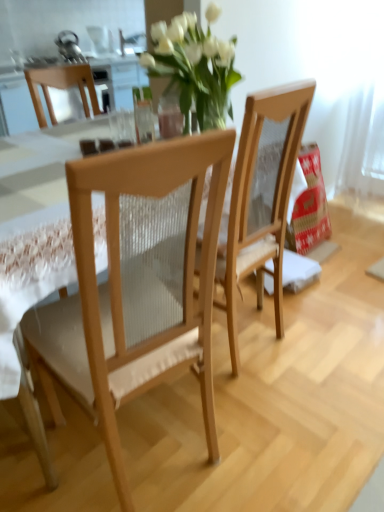
Where is `light wood mesh chair at center, the first chair viewed from the left`? This screenshot has width=384, height=512. light wood mesh chair at center, the first chair viewed from the left is located at coordinates (136, 285).

The image size is (384, 512). Describe the element at coordinates (136, 285) in the screenshot. I see `light wood mesh chair at center, the first chair viewed from the left` at that location.

What do you see at coordinates (261, 198) in the screenshot?
I see `natural wood chair at center, marked as the 1th chair in a right-to-left arrangement` at bounding box center [261, 198].

Find the location of a particular element. Image resolution: width=384 pixels, height=512 pixels. natural wood chair at center, marked as the 1th chair in a right-to-left arrangement is located at coordinates (261, 198).

What is the approximate width of natural wood chair at center, marked as the 1th chair in a right-to-left arrangement?

natural wood chair at center, marked as the 1th chair in a right-to-left arrangement, is 17.62 inches in width.

What are the coordinates of `light wood mesh chair at center, the first chair viewed from the left` in the screenshot? It's located at (136, 285).

Is natural wood chair at center, marked as the 1th chair in a right-to-left arrangement, to the left of light wood mesh chair at center, the first chair viewed from the left, from the viewer's perspective?

In fact, natural wood chair at center, marked as the 1th chair in a right-to-left arrangement, is to the right of light wood mesh chair at center, the first chair viewed from the left.

In the image, is natural wood chair at center, the 2th chair in the left-to-right sequence, positioned in front of or behind light wood mesh chair at center, the second chair viewed from the right?

Visually, natural wood chair at center, the 2th chair in the left-to-right sequence, is located behind light wood mesh chair at center, the second chair viewed from the right.

Between point (284, 159) and point (88, 181), which one is positioned in front?

The point (88, 181) is closer to the camera.

Looking at this image, from the image's perspective, which is below, natural wood chair at center, the 2th chair in the left-to-right sequence, or light wood mesh chair at center, the first chair viewed from the left?

light wood mesh chair at center, the first chair viewed from the left, from the image's perspective.

From a real-world perspective, is natural wood chair at center, the 2th chair in the left-to-right sequence, physically located above or below light wood mesh chair at center, the first chair viewed from the left?

Clearly, from a real-world perspective, natural wood chair at center, the 2th chair in the left-to-right sequence, is above light wood mesh chair at center, the first chair viewed from the left.

Between natural wood chair at center, the 2th chair in the left-to-right sequence, and light wood mesh chair at center, the second chair viewed from the right, which one has larger width?

Wider between the two is light wood mesh chair at center, the second chair viewed from the right.

Which of these two, natural wood chair at center, the 2th chair in the left-to-right sequence, or light wood mesh chair at center, the first chair viewed from the left, stands shorter?

With less height is light wood mesh chair at center, the first chair viewed from the left.

Based on their sizes in the image, would you say natural wood chair at center, the 2th chair in the left-to-right sequence, is bigger or smaller than light wood mesh chair at center, the first chair viewed from the left?

Considering their sizes, natural wood chair at center, the 2th chair in the left-to-right sequence, takes up less space than light wood mesh chair at center, the first chair viewed from the left.

Would you say light wood mesh chair at center, the second chair viewed from the right, is part of natural wood chair at center, the 2th chair in the left-to-right sequence,'s contents?

Definitely not — light wood mesh chair at center, the second chair viewed from the right, is not inside natural wood chair at center, the 2th chair in the left-to-right sequence.

Is natural wood chair at center, the 2th chair in the left-to-right sequence, directly adjacent to light wood mesh chair at center, the second chair viewed from the right?

No, natural wood chair at center, the 2th chair in the left-to-right sequence, is not touching light wood mesh chair at center, the second chair viewed from the right.

Is natural wood chair at center, the 2th chair in the left-to-right sequence, turned away from light wood mesh chair at center, the first chair viewed from the left?

No, natural wood chair at center, the 2th chair in the left-to-right sequence,'s orientation is not away from light wood mesh chair at center, the first chair viewed from the left.

Can you tell me how much natural wood chair at center, marked as the 1th chair in a right-to-left arrangement, and light wood mesh chair at center, the first chair viewed from the left, differ in facing direction?

The facing directions of natural wood chair at center, marked as the 1th chair in a right-to-left arrangement, and light wood mesh chair at center, the first chair viewed from the left, are 10.1 degrees apart.

The width and height of the screenshot is (384, 512). Find the location of `chair positioned vertically above the light wood mesh chair at center, the first chair viewed from the left (from a real-world perspective)`. chair positioned vertically above the light wood mesh chair at center, the first chair viewed from the left (from a real-world perspective) is located at coordinates (261, 198).

Is light wood mesh chair at center, the first chair viewed from the left, to the left or to the right of natural wood chair at center, the 2th chair in the left-to-right sequence, in the image?

light wood mesh chair at center, the first chair viewed from the left, is positioned on natural wood chair at center, the 2th chair in the left-to-right sequence,'s left side.

Is light wood mesh chair at center, the first chair viewed from the left, closer to camera compared to natural wood chair at center, the 2th chair in the left-to-right sequence?

Yes, light wood mesh chair at center, the first chair viewed from the left, is in front of natural wood chair at center, the 2th chair in the left-to-right sequence.

Considering the positions of points (201, 262) and (290, 85), is point (201, 262) closer to camera compared to point (290, 85)?

Yes, it is in front of point (290, 85).

From the image's perspective, is light wood mesh chair at center, the first chair viewed from the left, under natural wood chair at center, the 2th chair in the left-to-right sequence?

Yes, from the image's perspective, light wood mesh chair at center, the first chair viewed from the left, is below natural wood chair at center, the 2th chair in the left-to-right sequence.

From a real-world perspective, which object rests below the other?

light wood mesh chair at center, the first chair viewed from the left, is physically lower.

Is light wood mesh chair at center, the second chair viewed from the right, thinner than natural wood chair at center, marked as the 1th chair in a right-to-left arrangement?

In fact, light wood mesh chair at center, the second chair viewed from the right, might be wider than natural wood chair at center, marked as the 1th chair in a right-to-left arrangement.

Which of these two, light wood mesh chair at center, the first chair viewed from the left, or natural wood chair at center, the 2th chair in the left-to-right sequence, stands shorter?

light wood mesh chair at center, the first chair viewed from the left, is shorter.

Is light wood mesh chair at center, the second chair viewed from the right, smaller than natural wood chair at center, marked as the 1th chair in a right-to-left arrangement?

Actually, light wood mesh chair at center, the second chair viewed from the right, might be larger than natural wood chair at center, marked as the 1th chair in a right-to-left arrangement.

In the scene shown: Would you say light wood mesh chair at center, the first chair viewed from the left, contains natural wood chair at center, marked as the 1th chair in a right-to-left arrangement?

No, light wood mesh chair at center, the first chair viewed from the left, does not contain natural wood chair at center, marked as the 1th chair in a right-to-left arrangement.

Is light wood mesh chair at center, the second chair viewed from the right, far away from natural wood chair at center, the 2th chair in the left-to-right sequence?

No, light wood mesh chair at center, the second chair viewed from the right, is in close proximity to natural wood chair at center, the 2th chair in the left-to-right sequence.

Is light wood mesh chair at center, the first chair viewed from the left, oriented towards natural wood chair at center, the 2th chair in the left-to-right sequence?

No, light wood mesh chair at center, the first chair viewed from the left, is not turned towards natural wood chair at center, the 2th chair in the left-to-right sequence.

From the picture: Can you tell me how much light wood mesh chair at center, the first chair viewed from the left, and natural wood chair at center, the 2th chair in the left-to-right sequence, differ in facing direction?

light wood mesh chair at center, the first chair viewed from the left, and natural wood chair at center, the 2th chair in the left-to-right sequence, are facing 10.1 degrees away from each other.

I want to click on chair positioned vertically above the light wood mesh chair at center, the first chair viewed from the left (from a real-world perspective), so click(261, 198).

At what (x,y) coordinates should I click in order to perform the action: click on chair in front of the natural wood chair at center, the 2th chair in the left-to-right sequence. Please return your answer as a coordinate pair (x, y). The image size is (384, 512). Looking at the image, I should click on (136, 285).

Identify the location of chair below the natural wood chair at center, the 2th chair in the left-to-right sequence (from the image's perspective). (136, 285).